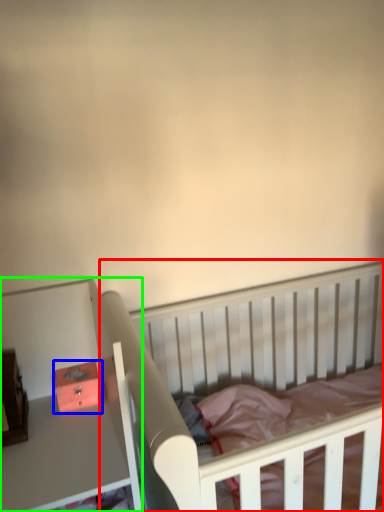
Question: Which object is positioned closest to infant bed (highlighted by a red box)? Select from box (highlighted by a blue box) and table (highlighted by a green box).

Choices:
 (A) box
 (B) table

Answer: (B)